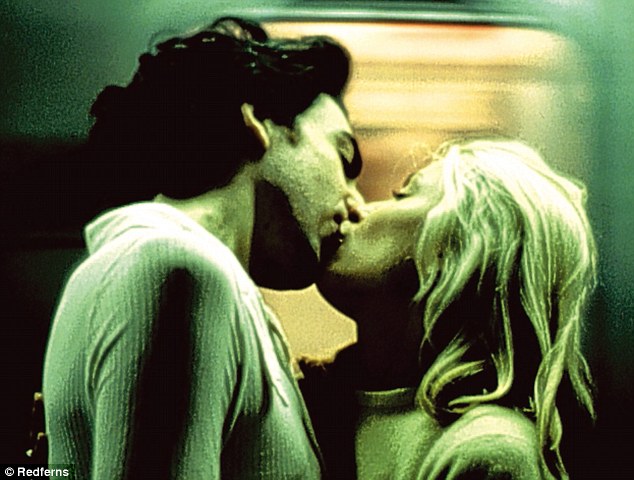
The height and width of the screenshot is (480, 634). Find the location of `dark wall`. dark wall is located at coordinates (35, 218).